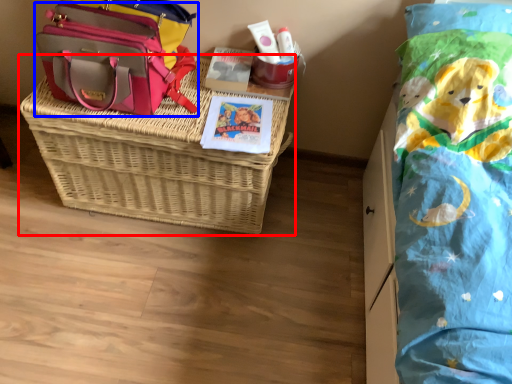
Question: Which of the following is the closest to the observer, picnic basket (highlighted by a red box) or shoulder bag (highlighted by a blue box)?

Choices:
 (A) picnic basket
 (B) shoulder bag

Answer: (A)